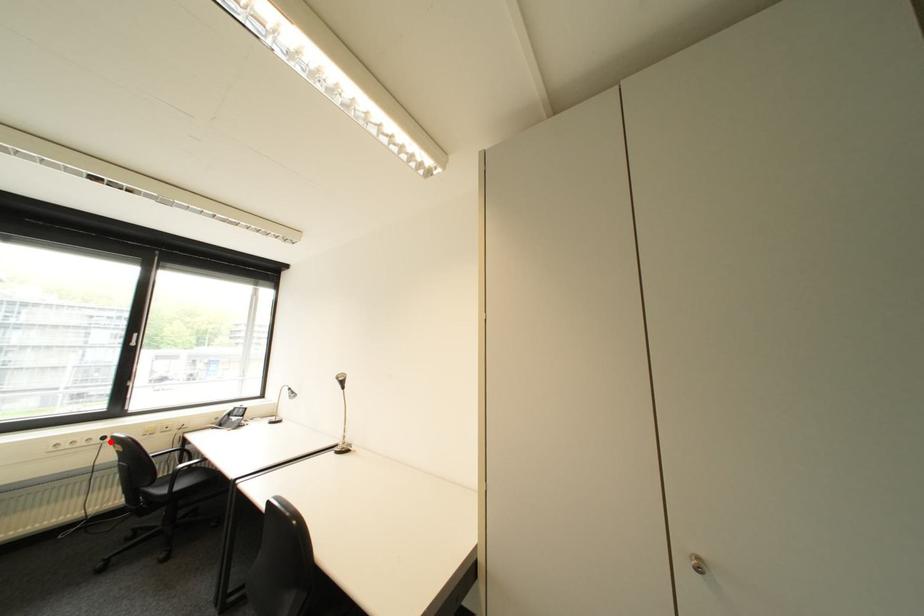
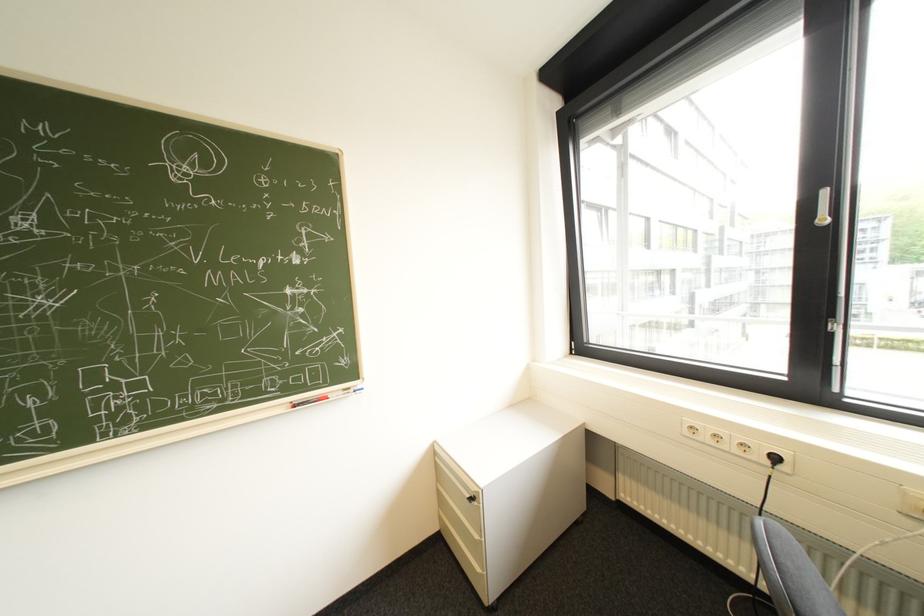
Locate, in the second image, the point that corresponds to the highlighted location in the first image.

(779, 463)